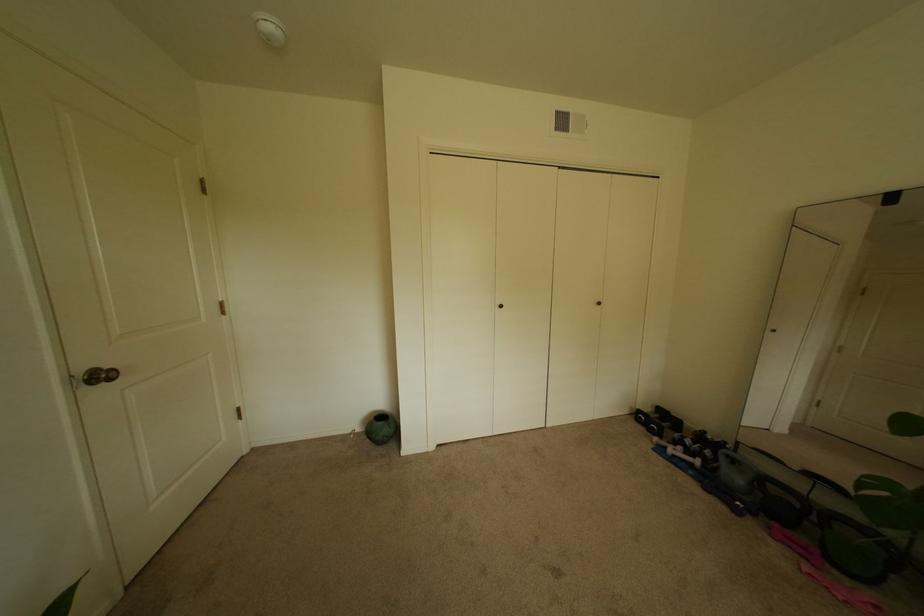
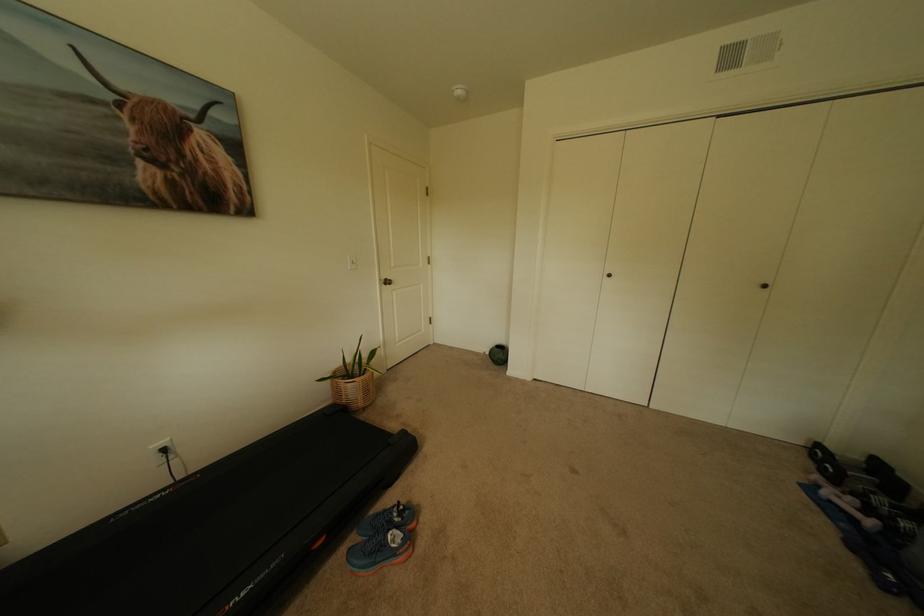
Where in the second image is the point corresponding to (x=699, y=464) from the first image?

(862, 521)